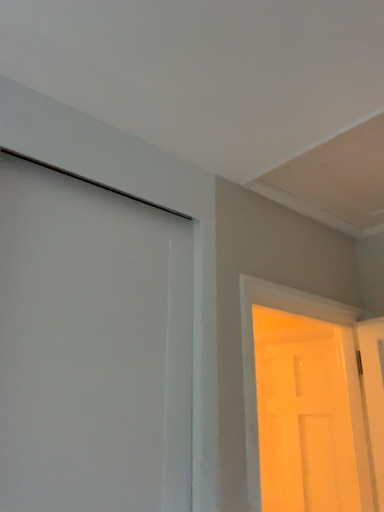
Where is `white glossy door at right`? white glossy door at right is located at coordinates (254, 353).

The image size is (384, 512). What do you see at coordinates (254, 353) in the screenshot?
I see `white glossy door at right` at bounding box center [254, 353].

You are a GUI agent. You are given a task and a screenshot of the screen. Output one action in this format:
    pyautogui.click(x=<x>, y=<y>)
    Task: Click on the white glossy door at right
    This screenshot has width=384, height=512.
    Given the screenshot: What is the action you would take?
    pyautogui.click(x=254, y=353)